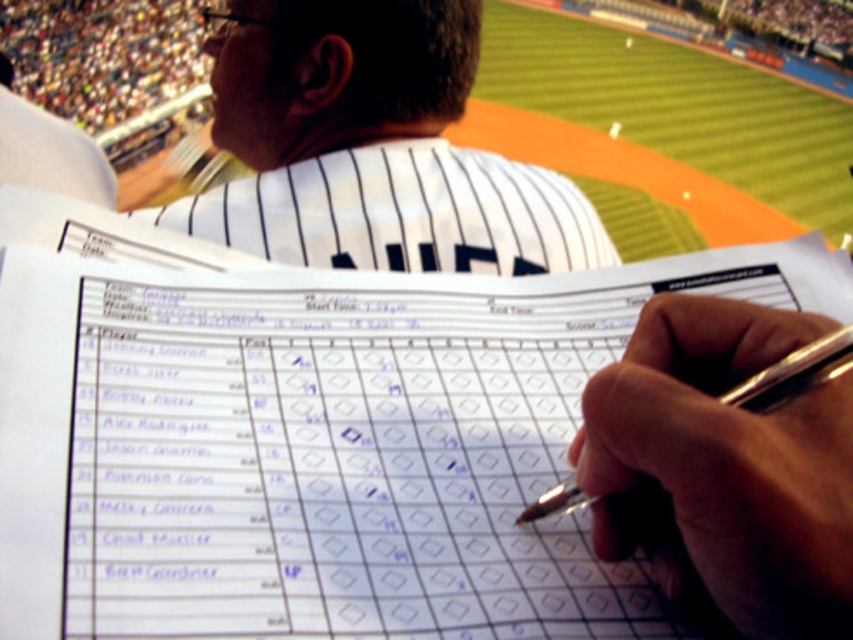
You are a photographer trying to capture a closeup of the silver metallic pen at center while ensuring the white pinstriped jersey at upper center remains visible in the frame. Based on their positions, can you position yourself so that both objects are in the shot?

The white pinstriped jersey at upper center is positioned on the left side of the silver metallic pen at center, so yes, you can position yourself to include both in the frame by framing the shot to include the left side where the jersey is and the center where the pen is located.

You are a photographer standing behind the stands and want to take a photo of both the white pinstriped jersey at upper center and the silver metallic pen at center. The minimum distance your camera can focus on two objects is 50 centimeters. Can you capture both in one shot?

The distance between the white pinstriped jersey at upper center and the silver metallic pen at center is 60.67 centimeters, which exceeds the camera minimum focusing distance of 50 centimeters. Therefore, you can capture both in one shot.

You are a photographer standing at the entrance of the baseball stadium, and you want to take a photo of the white pinstriped jersey at upper center. According to the scene description, where should you aim your camera to capture it?

You should aim your camera at the point with coordinates (372, 147) to capture the white pinstriped jersey at upper center.